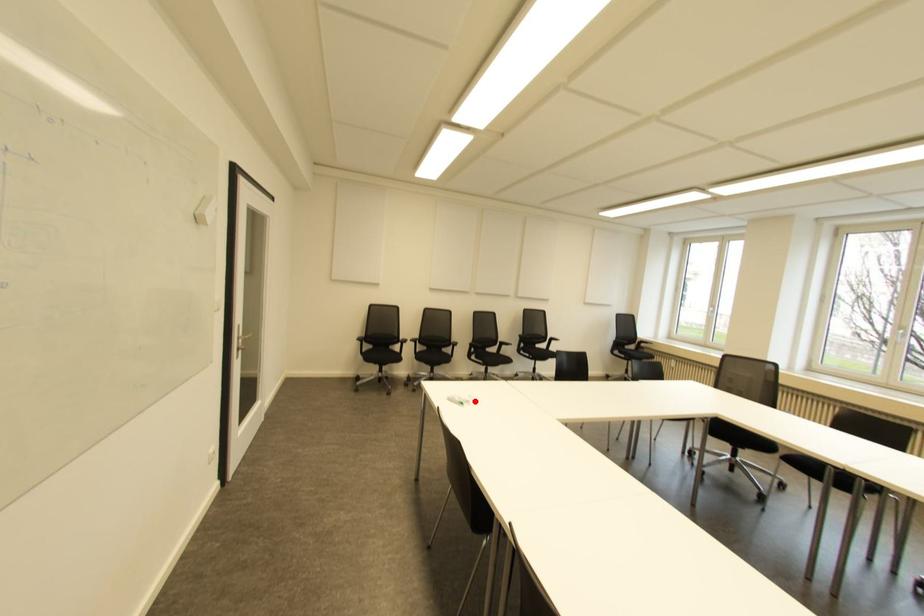
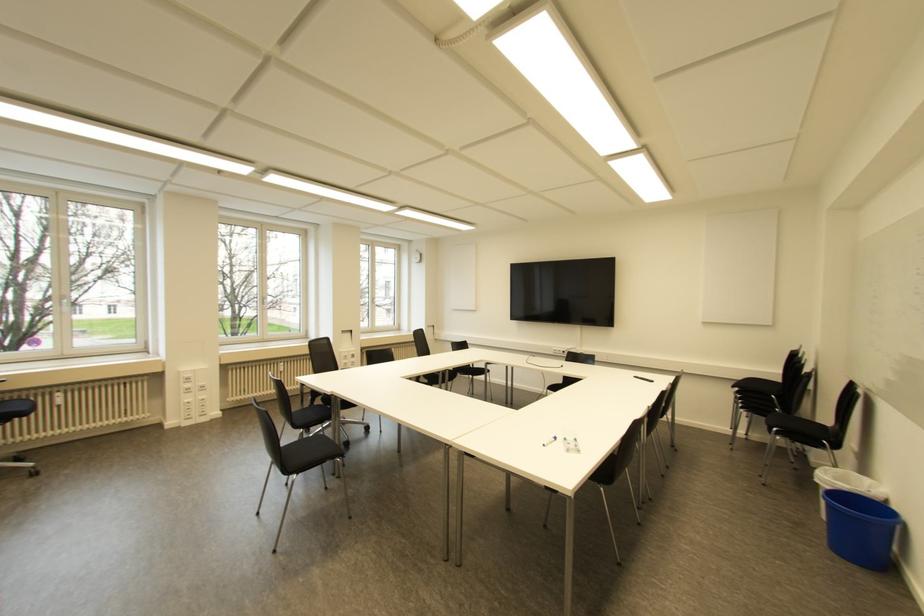
Question: I am providing you with two images of the same scene from different viewpoints. In image1, a red point is highlighted. Considering the same 3D point in image2, which of the following is correct?

Choices:
 (A) It is closer
 (B) It is farther

Answer: (B)